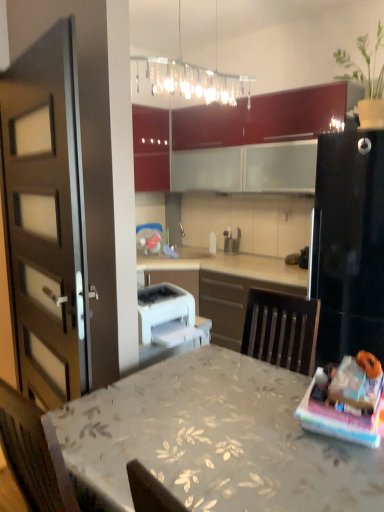
Question: Is green matte plant at upper right next to white plastic printer at center, placed as the second appliance when sorted from right to left?

Choices:
 (A) yes
 (B) no

Answer: (B)

Question: Considering the relative sizes of green matte plant at upper right and white plastic printer at center, the 1th appliance positioned from the bottom, in the image provided, is green matte plant at upper right taller than white plastic printer at center, the 1th appliance positioned from the bottom,?

Choices:
 (A) no
 (B) yes

Answer: (B)

Question: Is green matte plant at upper right completely or partially outside of white plastic printer at center, the second appliance from the back?

Choices:
 (A) no
 (B) yes

Answer: (B)

Question: Is white plastic printer at center, placed as the second appliance when sorted from right to left, located within green matte plant at upper right?

Choices:
 (A) yes
 (B) no

Answer: (B)

Question: Is green matte plant at upper right far from white plastic printer at center, the second appliance from the back?

Choices:
 (A) yes
 (B) no

Answer: (A)

Question: Would you say white plastic printer at center, the 1th appliance positioned from the bottom, is inside or outside clear glass light fixture at upper center?

Choices:
 (A) outside
 (B) inside

Answer: (A)

Question: In terms of size, does white plastic printer at center, the second appliance from the back, appear bigger or smaller than clear glass light fixture at upper center?

Choices:
 (A) small
 (B) big

Answer: (A)

Question: Is white plastic printer at center, placed as the second appliance when sorted from right to left, taller or shorter than clear glass light fixture at upper center?

Choices:
 (A) tall
 (B) short

Answer: (B)

Question: Would you say white plastic printer at center, marked as the 1th appliance in a front-to-back arrangement, is to the left or to the right of clear glass light fixture at upper center in the picture?

Choices:
 (A) left
 (B) right

Answer: (A)

Question: Is clear glass light fixture at upper center bigger or smaller than metallic silver spice shakers at center, which is the first appliance in top-to-bottom order?

Choices:
 (A) small
 (B) big

Answer: (B)

Question: Considering their positions, is clear glass light fixture at upper center located in front of or behind metallic silver spice shakers at center, which is the first appliance in top-to-bottom order?

Choices:
 (A) front
 (B) behind

Answer: (A)

Question: Do you think clear glass light fixture at upper center is within metallic silver spice shakers at center, marked as the 2th appliance in a left-to-right arrangement, or outside of it?

Choices:
 (A) inside
 (B) outside

Answer: (B)

Question: Is clear glass light fixture at upper center to the left or to the right of metallic silver spice shakers at center, positioned as the 2th appliance in bottom-to-top order, in the image?

Choices:
 (A) left
 (B) right

Answer: (A)

Question: Considering the positions of white plastic printer at center, the 1th appliance from the left, and matte brown door at left in the image, is white plastic printer at center, the 1th appliance from the left, bigger or smaller than matte brown door at left?

Choices:
 (A) big
 (B) small

Answer: (B)

Question: From the image's perspective, is white plastic printer at center, the 1th appliance from the left, located above or below matte brown door at left?

Choices:
 (A) below
 (B) above

Answer: (A)